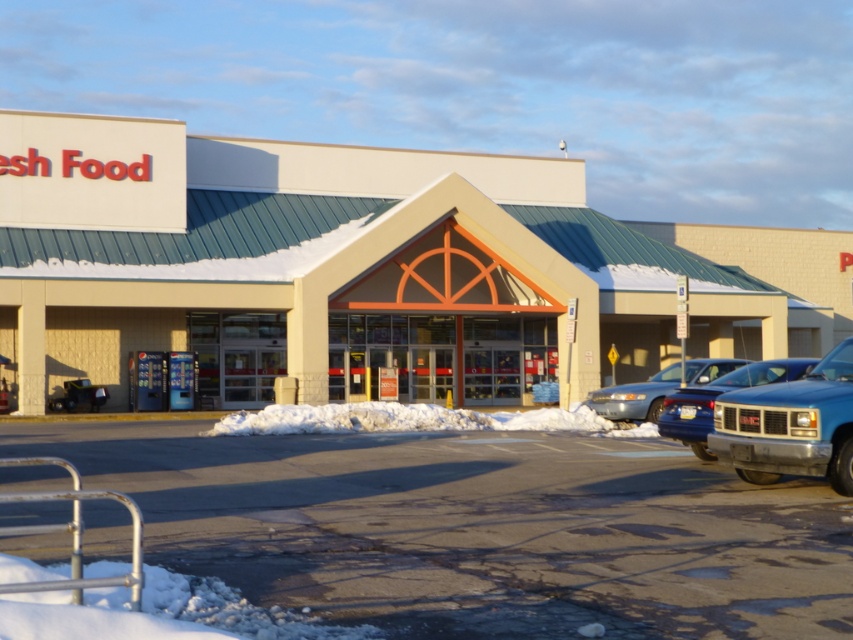
Question: Where is beige/concrete mall at center located in relation to blue metallic truck at right in the image?

Choices:
 (A) above
 (B) below

Answer: (A)

Question: Does pavement asphalt at center appear over blue metallic truck at right?

Choices:
 (A) no
 (B) yes

Answer: (A)

Question: Which point is closer to the camera taking this photo?

Choices:
 (A) (431, 417)
 (B) (705, 592)

Answer: (B)

Question: Where is blue metallic truck at right located in relation to blue metallic sedan at center in the image?

Choices:
 (A) right
 (B) left

Answer: (A)

Question: Among these objects, which one is nearest to the camera?

Choices:
 (A) pavement asphalt at center
 (B) white fluffy snow at center

Answer: (A)

Question: Which object is the closest to the blue metallic sedan at center?

Choices:
 (A) beige/concrete mall at center
 (B) blue metallic truck at right

Answer: (B)